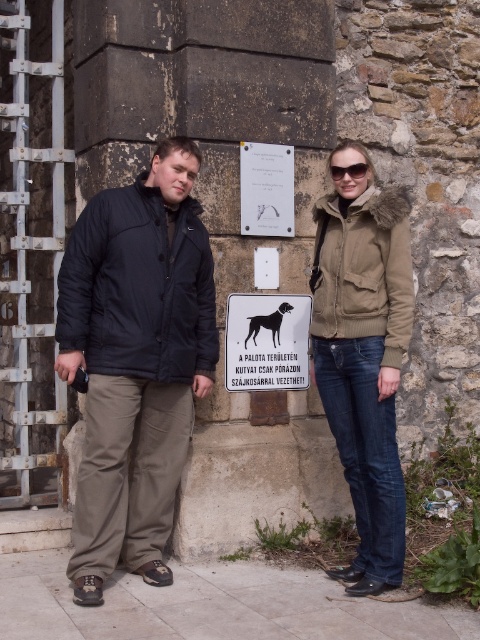
You are a fashion designer analyzing the outfits in the image. Which of the two dark blue jackets, the dark blue puffy jacket at center or the dark blue jacket at center, has a larger width?

The dark blue puffy jacket at center has a larger width than the dark blue jacket at center according to the description.

You are a photographer standing 10 feet away from the camera. You want to take a photo of the black glossy dog at center. Can you reach the dog within 5 feet of its current position without moving the camera?

The black glossy dog at center and camera are 13.66 feet apart. Since you are 10 feet away from the camera, the distance between you and the dog is 13.66 minus 10 equals 3.66 feet. Therefore, you can reach the dog within 5 feet of its current position without moving the camera.

You are a photographer trying to capture a clear shot of the black glossy dog at center and the sunglasses at center. Since both are at the same position, you need to adjust your camera focus. Which object should you focus on first to ensure it appears larger in the photo?

The black glossy dog at center has a greater height compared to sunglasses at center, so focusing on the black glossy dog at center first will ensure it appears larger in the photo.